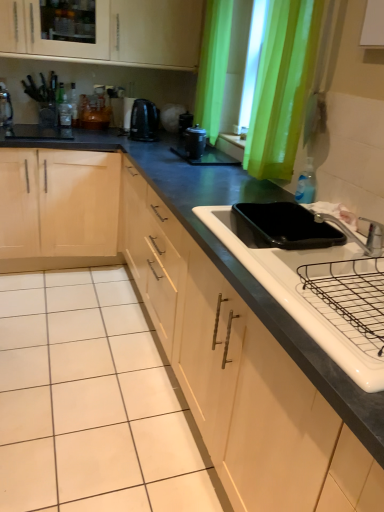
The image size is (384, 512). I want to click on blank area to the left of clear glass bottle at upper left, positioned as the 2th bottle in bottom-to-top order, so (52, 122).